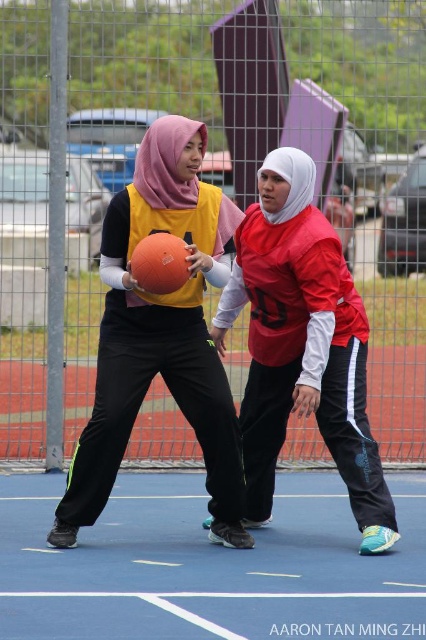
Question: Can you confirm if matte orange basketball at center is wider than orange matte basketball at center?

Choices:
 (A) no
 (B) yes

Answer: (B)

Question: Estimate the real-world distances between objects in this image. Which object is farther from the matte red jersey at center?

Choices:
 (A) orange matte basketball at center
 (B) matte orange basketball at center

Answer: (A)

Question: Observing the image, what is the correct spatial positioning of matte orange basketball at center in reference to orange matte basketball at center?

Choices:
 (A) below
 (B) above

Answer: (A)

Question: Which point is closer to the camera?

Choices:
 (A) matte orange basketball at center
 (B) matte red jersey at center

Answer: (B)

Question: Estimate the real-world distances between objects in this image. Which object is closer to the orange matte basketball at center?

Choices:
 (A) matte orange basketball at center
 (B) matte red jersey at center

Answer: (A)

Question: In this image, where is matte orange basketball at center located relative to orange matte basketball at center?

Choices:
 (A) right
 (B) left

Answer: (B)